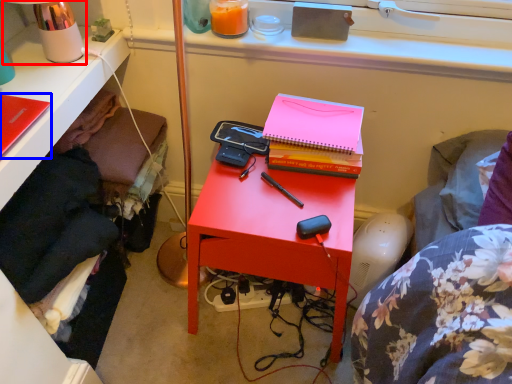
Question: Among these objects, which one is nearest to the camera, table lamp (highlighted by a red box) or notebook (highlighted by a blue box)?

Choices:
 (A) table lamp
 (B) notebook

Answer: (B)